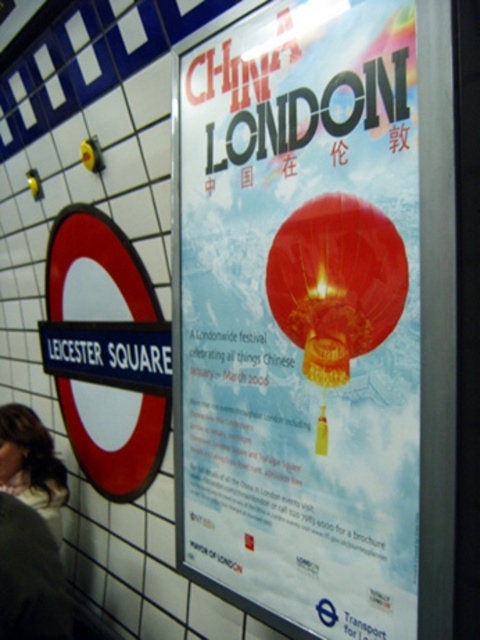
You are standing in front of the subway station wall at Leicester Square. There are two points marked on the wall. The first point is at coordinate (179, 289) and the second is at (22, 480). Which point is closer to you?

Point (179, 289) is closer to the viewer than point (22, 480).

You are a photographer standing in front of the Leicester Square subway station wall. You notice the metallic round sign at left and the blonde hair at lower left. Which object would appear bigger in your camera viewfinder?

The metallic round sign at left appears bigger in the camera viewfinder because it is larger in size than the blonde hair at lower left.

You are a photographer standing in front of the subway station wall at Leicester Square. You notice the metallic round sign at left and the blonde hair at lower left. Which object is closer to the center of the wall?

The metallic round sign at left is positioned on the right side of blonde hair at lower left, meaning it is closer to the center of the wall than the blonde hair at lower left.